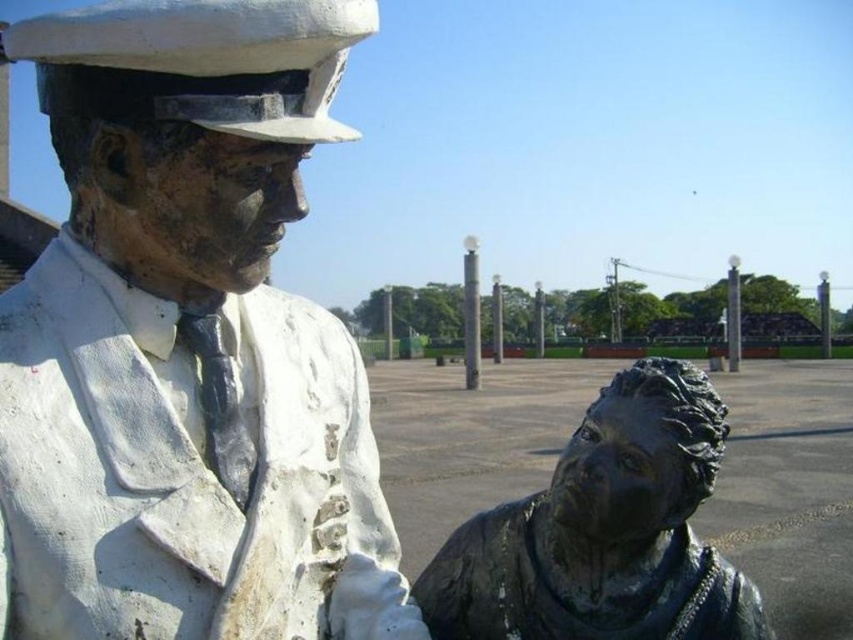
You are standing at the point labeled point (369, 28). You want to walk to the statue on the left and then to the statue on the right. What is the total distance you will walk?

The total distance you will walk is 4.40 feet.

You are standing in front of two bronze statues. One is labeled as the bronze statue at left, and the other is the bronze statue at lower right. From your perspective, which statue is positioned to the left?

The bronze statue at left is positioned to the left of the bronze statue at lower right.